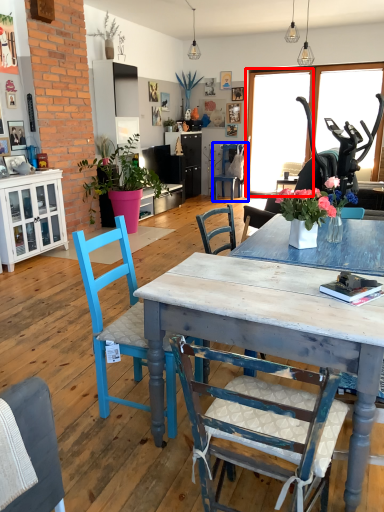
Question: Which object appears closest to the camera in this image, window screen (highlighted by a red box) or chair (highlighted by a blue box)?

Choices:
 (A) window screen
 (B) chair

Answer: (A)